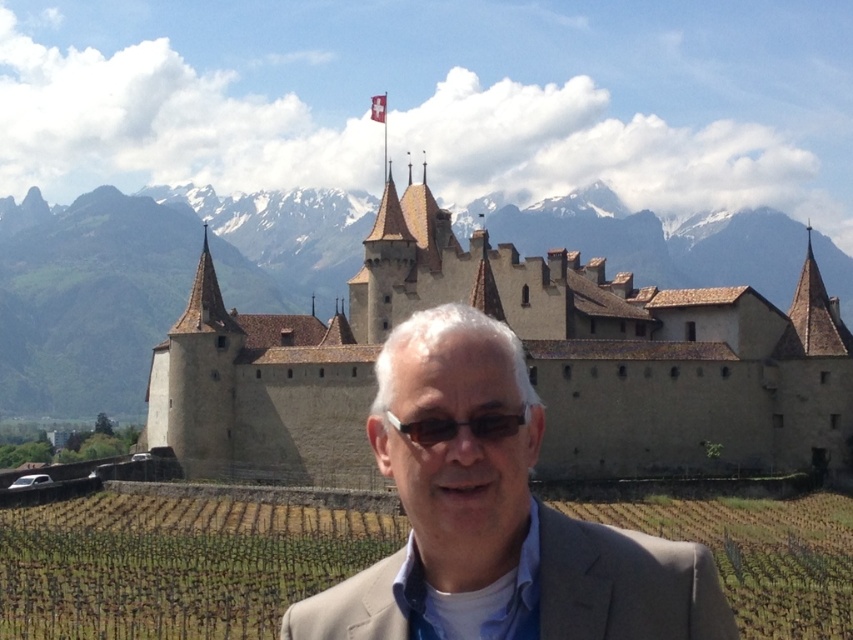
Question: Can you confirm if beige stone castle at center is wider than sunglasses at center?

Choices:
 (A) no
 (B) yes

Answer: (B)

Question: Can you confirm if beige stone castle at center is positioned above sunglasses at center?

Choices:
 (A) yes
 (B) no

Answer: (A)

Question: Which is nearer to the beige stone castle at center?

Choices:
 (A) light brown suit at center
 (B) sunglasses at center

Answer: (A)

Question: Which of the following is the closest to the observer?

Choices:
 (A) light brown suit at center
 (B) beige stone castle at center

Answer: (A)

Question: Is light brown suit at center in front of sunglasses at center?

Choices:
 (A) no
 (B) yes

Answer: (B)

Question: Among these points, which one is farthest from the camera?

Choices:
 (A) (527, 458)
 (B) (473, 433)
 (C) (343, 472)

Answer: (C)